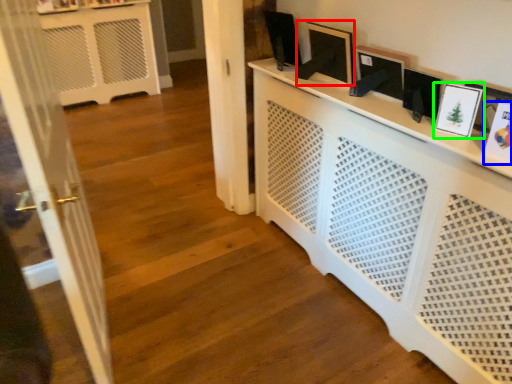
Question: Estimate the real-world distances between objects in this image. Which object is farther from picture frame (highlighted by a red box), picture frame (highlighted by a blue box) or picture frame (highlighted by a green box)?

Choices:
 (A) picture frame
 (B) picture frame

Answer: (A)